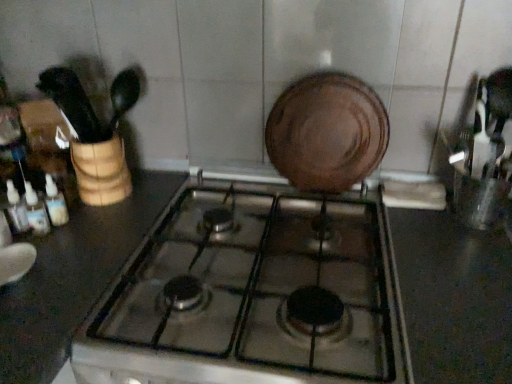
Question: Does metallic glass gas stove at center have a lesser width compared to brown matte plate at center?

Choices:
 (A) yes
 (B) no

Answer: (B)

Question: Can you confirm if metallic glass gas stove at center is shorter than brown matte plate at center?

Choices:
 (A) yes
 (B) no

Answer: (A)

Question: Is brown matte plate at center inside metallic glass gas stove at center?

Choices:
 (A) no
 (B) yes

Answer: (A)

Question: Is metallic glass gas stove at center directly adjacent to brown matte plate at center?

Choices:
 (A) yes
 (B) no

Answer: (B)

Question: From a real-world perspective, is metallic glass gas stove at center over brown matte plate at center?

Choices:
 (A) yes
 (B) no

Answer: (B)

Question: Is translucent plastic bottles at left, the 3th bottle when ordered from left to right, to the left or to the right of translucent plastic bottles at left, the 2th bottle positioned from the left, in the image?

Choices:
 (A) left
 (B) right

Answer: (B)

Question: Considering their positions, is translucent plastic bottles at left, the 3th bottle when ordered from left to right, located in front of or behind translucent plastic bottles at left, the 2th bottle positioned from the left?

Choices:
 (A) front
 (B) behind

Answer: (B)

Question: Is point (66, 215) positioned closer to the camera than point (38, 223)?

Choices:
 (A) farther
 (B) closer

Answer: (A)

Question: From the image's perspective, is translucent plastic bottles at left, the 3th bottle when ordered from left to right, above or below translucent plastic bottles at left, the 2th bottle positioned from the left?

Choices:
 (A) above
 (B) below

Answer: (A)

Question: From their relative heights in the image, would you say brown matte plate at center is taller or shorter than translucent plastic bottles at left, which is the third bottle from right to left?

Choices:
 (A) tall
 (B) short

Answer: (A)

Question: Which is correct: brown matte plate at center is inside translucent plastic bottles at left, which is the third bottle from right to left, or outside of it?

Choices:
 (A) inside
 (B) outside

Answer: (B)

Question: In the image, is brown matte plate at center positioned in front of or behind translucent plastic bottles at left, the 1th bottle when ordered from left to right?

Choices:
 (A) behind
 (B) front

Answer: (A)

Question: From a real-world perspective, is brown matte plate at center positioned above or below translucent plastic bottles at left, the 1th bottle when ordered from left to right?

Choices:
 (A) above
 (B) below

Answer: (A)

Question: Is translucent plastic bottles at left, which appears as the second bottle when viewed from the right, wider or thinner than black glossy countertop at center?

Choices:
 (A) thin
 (B) wide

Answer: (A)

Question: Would you say translucent plastic bottles at left, which appears as the second bottle when viewed from the right, is inside or outside black glossy countertop at center?

Choices:
 (A) inside
 (B) outside

Answer: (B)